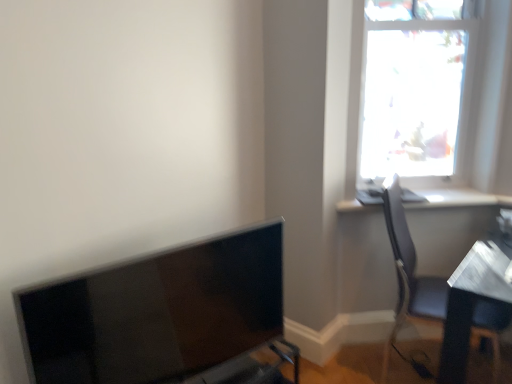
Question: From the image's perspective, does transparent glass window at upper right appear lower than matte black monitor at lower left?

Choices:
 (A) yes
 (B) no

Answer: (B)

Question: Is transparent glass window at upper right facing towards matte black monitor at lower left?

Choices:
 (A) no
 (B) yes

Answer: (A)

Question: Is transparent glass window at upper right at the right side of matte black monitor at lower left?

Choices:
 (A) yes
 (B) no

Answer: (A)

Question: Does transparent glass window at upper right have a larger size compared to matte black monitor at lower left?

Choices:
 (A) yes
 (B) no

Answer: (B)

Question: Is transparent glass window at upper right to the left of matte black monitor at lower left from the viewer's perspective?

Choices:
 (A) yes
 (B) no

Answer: (B)

Question: Is matte black monitor at lower left taller or shorter than white glossy window sill at upper right?

Choices:
 (A) tall
 (B) short

Answer: (A)

Question: From a real-world perspective, relative to white glossy window sill at upper right, is matte black monitor at lower left vertically above or below?

Choices:
 (A) below
 (B) above

Answer: (A)

Question: Is point (240, 377) positioned closer to the camera than point (474, 205)?

Choices:
 (A) farther
 (B) closer

Answer: (B)

Question: Considering the positions of matte black monitor at lower left and white glossy window sill at upper right in the image, is matte black monitor at lower left wider or thinner than white glossy window sill at upper right?

Choices:
 (A) wide
 (B) thin

Answer: (B)

Question: Is point (437, 311) closer or farther from the camera than point (506, 195)?

Choices:
 (A) closer
 (B) farther

Answer: (A)

Question: Considering their positions, is matte gray chair at right located in front of or behind white glossy window sill at upper right?

Choices:
 (A) front
 (B) behind

Answer: (A)

Question: Is matte gray chair at right bigger or smaller than white glossy window sill at upper right?

Choices:
 (A) small
 (B) big

Answer: (B)

Question: Would you say matte gray chair at right is to the left or to the right of white glossy window sill at upper right in the picture?

Choices:
 (A) right
 (B) left

Answer: (A)

Question: From the image's perspective, is white glossy window sill at upper right located above or below matte gray chair at right?

Choices:
 (A) above
 (B) below

Answer: (A)

Question: Relative to matte gray chair at right, is white glossy window sill at upper right in front or behind?

Choices:
 (A) behind
 (B) front

Answer: (A)